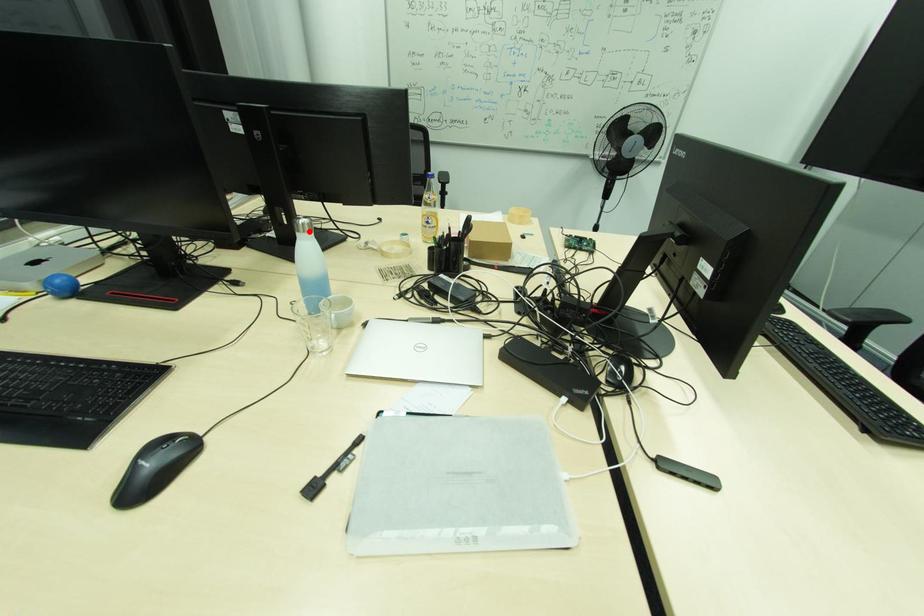
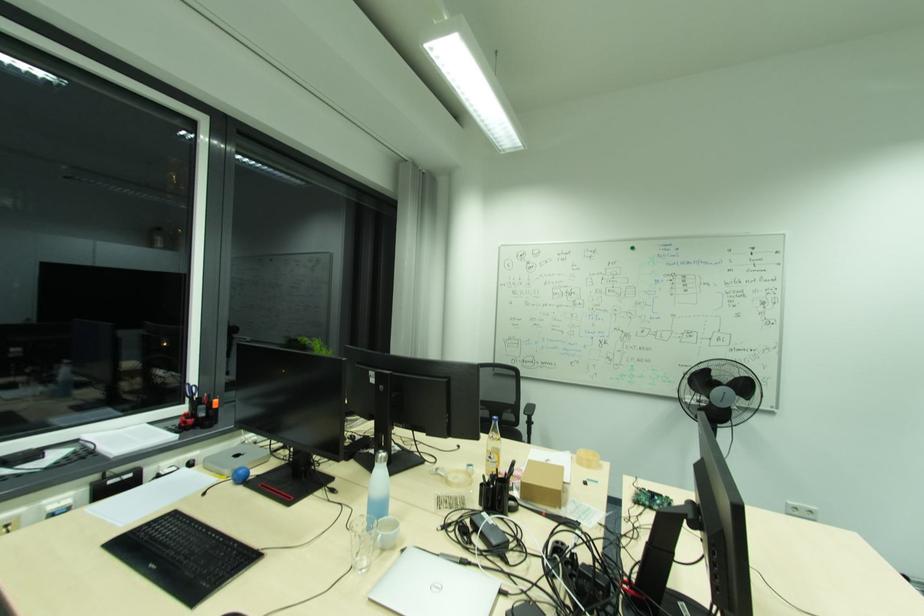
In the second image, find the point that corresponds to the highlighted location in the first image.

(385, 461)